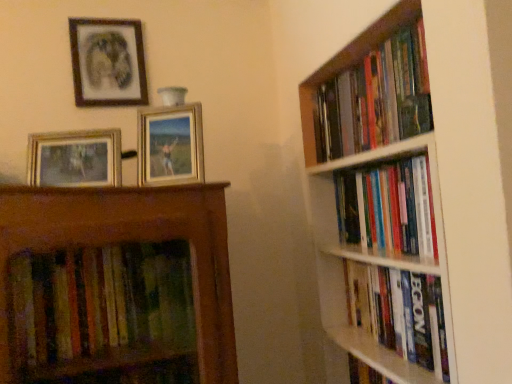
Question: From the image's perspective, is hardcover books at right, marked as the 2th book in a top-to-bottom arrangement, located above or below hardcover books at right, arranged as the first book when viewed from the top?

Choices:
 (A) above
 (B) below

Answer: (B)

Question: Considering the positions of hardcover books at right, marked as the 2th book in a top-to-bottom arrangement, and hardcover books at right, the 3th book in the bottom-to-top sequence, in the image, is hardcover books at right, marked as the 2th book in a top-to-bottom arrangement, wider or thinner than hardcover books at right, the 3th book in the bottom-to-top sequence,?

Choices:
 (A) thin
 (B) wide

Answer: (B)

Question: Estimate the real-world distances between objects in this image. Which object is farther from the white wooden bookshelf at right?

Choices:
 (A) gold metallic picture frame at upper left, which is the 1th picture frame from front to back
 (B) hardcover books at right, placed as the 2th book when sorted from bottom to top
 (C) hardcover books at right, the 3th book in the bottom-to-top sequence
 (D) matte black picture frame at upper left, the 3th picture frame viewed from the front
 (E) hardcover book at right, the first book positioned from the bottom

Answer: (D)

Question: Based on their relative distances, which object is nearer to the hardcover books at right, arranged as the first book when viewed from the top?

Choices:
 (A) hardcover books at right, placed as the 2th book when sorted from bottom to top
 (B) gold metallic picture frame at upper left, which ranks as the third picture frame in back-to-front order
 (C) hardcover book at right, which ranks as the third book in top-to-bottom order
 (D) matte black picture frame at upper left, which is counted as the first picture frame, starting from the top
 (E) white wooden bookshelf at right

Answer: (E)